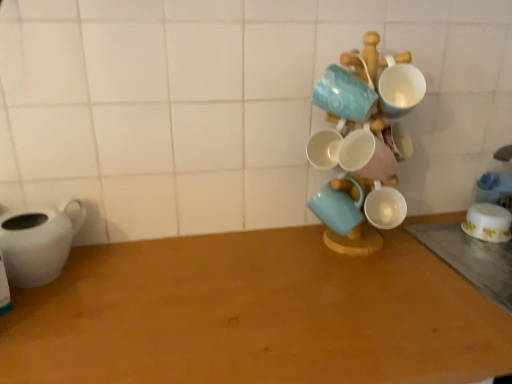
Identify the location of vacant space to the left of white glossy mugs at center-right. The image size is (512, 384). (274, 255).